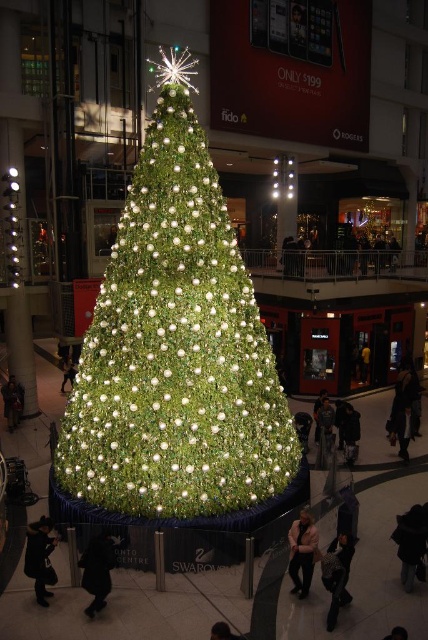
Question: Which point is closer to the camera?

Choices:
 (A) click(139, 259)
 (B) click(104, 557)
 (C) click(409, 580)
 (D) click(44, 525)

Answer: (B)

Question: Which object appears farthest from the camera in this image?

Choices:
 (A) black fabric coat at lower left
 (B) dark gray coat at lower left

Answer: (B)

Question: Does dark gray coat at lower right have a greater width compared to black fabric coat at lower left?

Choices:
 (A) no
 (B) yes

Answer: (A)

Question: Observing the image, what is the correct spatial positioning of dark gray coat at lower left in reference to light beige sweater at lower center?

Choices:
 (A) below
 (B) above

Answer: (B)

Question: Which of the following is the farthest from the observer?

Choices:
 (A) light beige sweater at lower center
 (B) dark gray coat at lower right
 (C) black fabric coat at lower left

Answer: (B)

Question: Can you confirm if black fabric coat at lower left is positioned to the left of black fuzzy coat at lower right?

Choices:
 (A) yes
 (B) no

Answer: (A)